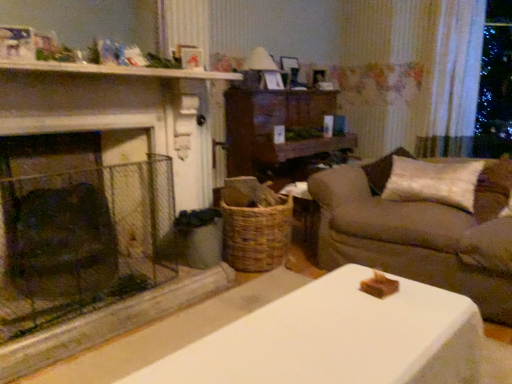
What do you see at coordinates (419, 234) in the screenshot? I see `beige fabric couch at right` at bounding box center [419, 234].

This screenshot has width=512, height=384. Describe the element at coordinates (433, 182) in the screenshot. I see `velvet beige pillow at right` at that location.

Find the location of `velvet beige pillow at right`. velvet beige pillow at right is located at coordinates (433, 182).

What do you see at coordinates (116, 70) in the screenshot?
I see `white painted wood mantle at upper center` at bounding box center [116, 70].

The width and height of the screenshot is (512, 384). In order to click on woven brown basket at center in this screenshot , I will do `click(256, 235)`.

Measure the distance between woven brown basket at center and camera.

The distance of woven brown basket at center from camera is 2.69 meters.

Describe the element at coordinates (260, 61) in the screenshot. I see `matte white lampshade at upper center` at that location.

The image size is (512, 384). Find the location of `matte white lampshade at upper center`. matte white lampshade at upper center is located at coordinates (260, 61).

This screenshot has width=512, height=384. What do you see at coordinates (455, 79) in the screenshot?
I see `white sheer curtain at upper right` at bounding box center [455, 79].

The height and width of the screenshot is (384, 512). What do you see at coordinates (81, 225) in the screenshot? I see `dark stone fireplace at left` at bounding box center [81, 225].

You are a GUI agent. You are given a task and a screenshot of the screen. Output one action in this format:
    pyautogui.click(x=<x>, y=<y>)
    Task: Click on the beige fabric couch at right
    Image resolution: width=512 pixels, height=384 pixels.
    Given the screenshot: What is the action you would take?
    pyautogui.click(x=419, y=234)

From a real-world perspective, is white painted wood mantle at upper center over beige fabric couch at right?

Yes, from a real-world perspective, white painted wood mantle at upper center is on top of beige fabric couch at right.

Considering the relative positions of white painted wood mantle at upper center and beige fabric couch at right in the image provided, is white painted wood mantle at upper center to the right of beige fabric couch at right from the viewer's perspective?

In fact, white painted wood mantle at upper center is to the left of beige fabric couch at right.

Between white painted wood mantle at upper center and beige fabric couch at right, which one has more height?

Standing taller between the two is beige fabric couch at right.

Is white painted wood mantle at upper center not close to beige fabric couch at right?

Yes, white painted wood mantle at upper center and beige fabric couch at right are quite far apart.

In terms of height, does dark stone fireplace at left look taller or shorter compared to velvet beige pillow at right?

Clearly, dark stone fireplace at left is taller compared to velvet beige pillow at right.

Could you tell me if dark stone fireplace at left is turned towards velvet beige pillow at right?

No, dark stone fireplace at left does not turn towards velvet beige pillow at right.

Considering the relative sizes of dark stone fireplace at left and velvet beige pillow at right in the image provided, is dark stone fireplace at left smaller than velvet beige pillow at right?

No.

Is beige fabric couch at right facing away from white sheer curtain at upper right?

Absolutely, beige fabric couch at right is directed away from white sheer curtain at upper right.

Looking at this image, who is taller, beige fabric couch at right or white sheer curtain at upper right?

Standing taller between the two is white sheer curtain at upper right.

From a real-world perspective, is beige fabric couch at right positioned above or below white sheer curtain at upper right?

beige fabric couch at right is below white sheer curtain at upper right.

Is beige fabric couch at right not close to white sheer curtain at upper right?

beige fabric couch at right is far away from white sheer curtain at upper right.

How different are the orientations of beige fabric couch at right and white painted wood mantle at upper center in degrees?

beige fabric couch at right and white painted wood mantle at upper center are facing 88.3 degrees away from each other.

Is beige fabric couch at right facing away from white painted wood mantle at upper center?

No, white painted wood mantle at upper center is not at the back of beige fabric couch at right.

Based on the photo, between beige fabric couch at right and white painted wood mantle at upper center, which one appears on the right side from the viewer's perspective?

beige fabric couch at right.

Looking at their sizes, would you say beige fabric couch at right is wider or thinner than white painted wood mantle at upper center?

Clearly, beige fabric couch at right has more width compared to white painted wood mantle at upper center.

Can you confirm if matte white lampshade at upper center is smaller than velvet beige pillow at right?

Yes.

Considering the points (256, 58) and (420, 191), which point is behind, point (256, 58) or point (420, 191)?

Point (256, 58)

Who is taller, matte white lampshade at upper center or velvet beige pillow at right?

Standing taller between the two is matte white lampshade at upper center.

From a real-world perspective, is matte white lampshade at upper center below velvet beige pillow at right?

Actually, matte white lampshade at upper center is physically above velvet beige pillow at right in the real world.

From a real-world perspective, which object rests below the other?

From a 3D spatial view, beige fabric couch at right is below.

Is beige fabric couch at right further to the viewer compared to matte white lampshade at upper center?

That is False.

Which of these two, beige fabric couch at right or woven brown basket at center, is thinner?

With smaller width is woven brown basket at center.

Is beige fabric couch at right bigger than woven brown basket at center?

Yes, beige fabric couch at right is bigger than woven brown basket at center.

From a real-world perspective, is beige fabric couch at right located higher than woven brown basket at center?

Yes, from a real-world perspective, beige fabric couch at right is above woven brown basket at center.

From the image's perspective, which is below, beige fabric couch at right or woven brown basket at center?

woven brown basket at center, from the image's perspective.

Image resolution: width=512 pixels, height=384 pixels. Identify the location of studio couch on the right of white painted wood mantle at upper center. (419, 234).

This screenshot has width=512, height=384. I want to click on fireplace located in front of the velvet beige pillow at right, so click(81, 225).

Estimate the real-world distances between objects in this image. Which object is further from velvet beige pillow at right, beige fabric couch at right or white sheer curtain at upper right?

white sheer curtain at upper right lies further to velvet beige pillow at right than the other object.

Which object lies further to the anchor point matte white lampshade at upper center, velvet beige pillow at right or white sheer curtain at upper right?

Among the two, white sheer curtain at upper right is located further to matte white lampshade at upper center.

Estimate the real-world distances between objects in this image. Which object is closer to beige fabric couch at right, white sheer curtain at upper right or velvet beige pillow at right?

velvet beige pillow at right is positioned closer to the anchor beige fabric couch at right.

Estimate the real-world distances between objects in this image. Which object is closer to woven brown basket at center, dark stone fireplace at left or matte white lampshade at upper center?

dark stone fireplace at left lies closer to woven brown basket at center than the other object.

From the image, which object appears to be farther from beige fabric couch at right, white sheer curtain at upper right or dark stone fireplace at left?

white sheer curtain at upper right is further to beige fabric couch at right.

Considering their positions, is white sheer curtain at upper right positioned further to white painted wood mantle at upper center than beige fabric couch at right?

Among the two, white sheer curtain at upper right is located further to white painted wood mantle at upper center.

Looking at the image, which one is located closer to dark stone fireplace at left, matte white lampshade at upper center or white painted wood mantle at upper center?

Based on the image, white painted wood mantle at upper center appears to be nearer to dark stone fireplace at left.

Based on their spatial positions, is white painted wood mantle at upper center or velvet beige pillow at right further from white sheer curtain at upper right?

Based on the image, white painted wood mantle at upper center appears to be further to white sheer curtain at upper right.

Locate an element on the screen. lamp situated between woven brown basket at center and white sheer curtain at upper right from left to right is located at coordinates (260, 61).

The width and height of the screenshot is (512, 384). I want to click on pillow between beige fabric couch at right and matte white lampshade at upper center along the z-axis, so click(433, 182).

I want to click on basket between white painted wood mantle at upper center and matte white lampshade at upper center in the front-back direction, so click(x=256, y=235).

The height and width of the screenshot is (384, 512). I want to click on studio couch between woven brown basket at center and velvet beige pillow at right from left to right, so click(419, 234).